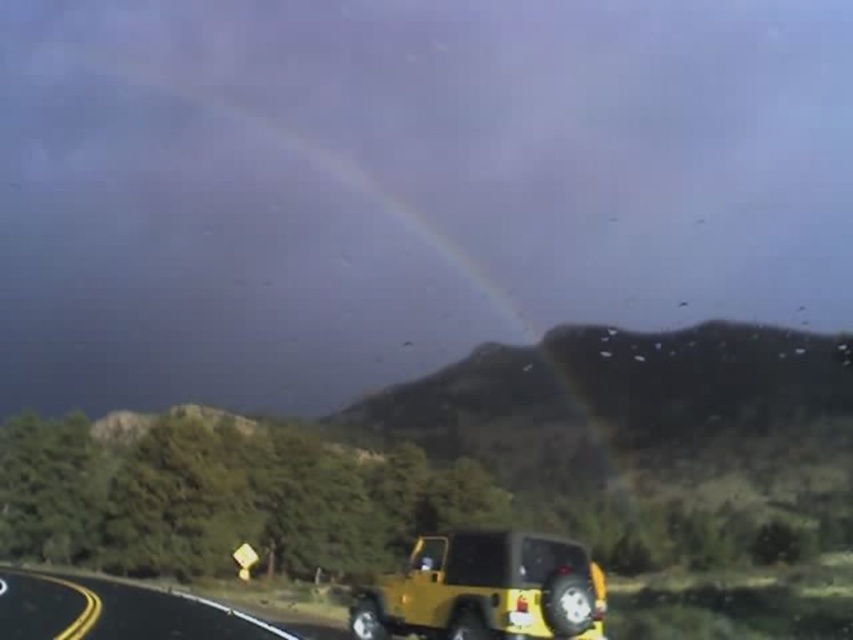
Question: Where is yellow matte jeep at lower right located in relation to yellow matte highway at lower left in the image?

Choices:
 (A) right
 (B) left

Answer: (A)

Question: Which of the following is the closest to the observer?

Choices:
 (A) (430, 602)
 (B) (196, 595)

Answer: (A)

Question: Which object is farther from the camera taking this photo?

Choices:
 (A) yellow matte jeep at lower right
 (B) yellow matte highway at lower left

Answer: (B)

Question: Does yellow matte jeep at lower right have a greater width compared to yellow matte highway at lower left?

Choices:
 (A) yes
 (B) no

Answer: (B)

Question: Can you confirm if yellow matte jeep at lower right is wider than yellow matte highway at lower left?

Choices:
 (A) no
 (B) yes

Answer: (A)